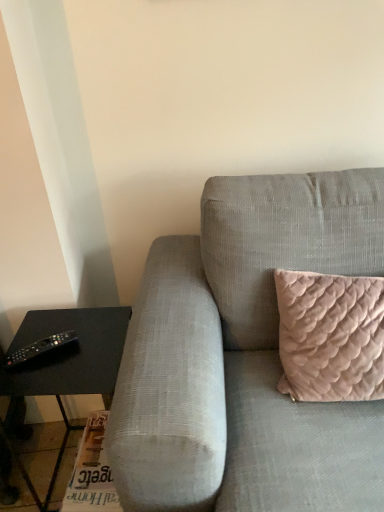
Question: Is textured gray couch at center looking in the opposite direction of black plastic remote at lower left?

Choices:
 (A) yes
 (B) no

Answer: (B)

Question: Can you confirm if textured gray couch at center is bigger than black plastic remote at lower left?

Choices:
 (A) yes
 (B) no

Answer: (A)

Question: Is textured gray couch at center shorter than black plastic remote at lower left?

Choices:
 (A) yes
 (B) no

Answer: (B)

Question: From a real-world perspective, does textured gray couch at center stand above black plastic remote at lower left?

Choices:
 (A) yes
 (B) no

Answer: (B)

Question: Can you confirm if textured gray couch at center is taller than black plastic remote at lower left?

Choices:
 (A) yes
 (B) no

Answer: (A)

Question: From a real-world perspective, relative to textured gray couch at center, is black matte table at left vertically above or below?

Choices:
 (A) below
 (B) above

Answer: (A)

Question: Which is correct: black matte table at left is inside textured gray couch at center, or outside of it?

Choices:
 (A) outside
 (B) inside

Answer: (A)

Question: Visually, is black matte table at left positioned to the left or to the right of textured gray couch at center?

Choices:
 (A) left
 (B) right

Answer: (A)

Question: From their relative heights in the image, would you say black matte table at left is taller or shorter than textured gray couch at center?

Choices:
 (A) short
 (B) tall

Answer: (A)

Question: From the image's perspective, is black plastic remote at lower left positioned above or below textured gray couch at center?

Choices:
 (A) below
 (B) above

Answer: (B)

Question: Considering the positions of black plastic remote at lower left and textured gray couch at center in the image, is black plastic remote at lower left taller or shorter than textured gray couch at center?

Choices:
 (A) short
 (B) tall

Answer: (A)

Question: Is black plastic remote at lower left in front of or behind textured gray couch at center in the image?

Choices:
 (A) behind
 (B) front

Answer: (A)

Question: From a real-world perspective, relative to textured gray couch at center, is black plastic remote at lower left vertically above or below?

Choices:
 (A) above
 (B) below

Answer: (A)

Question: Is black plastic remote at lower left wider or thinner than black matte table at left?

Choices:
 (A) thin
 (B) wide

Answer: (A)

Question: Considering the positions of black plastic remote at lower left and black matte table at left in the image, is black plastic remote at lower left bigger or smaller than black matte table at left?

Choices:
 (A) small
 (B) big

Answer: (A)